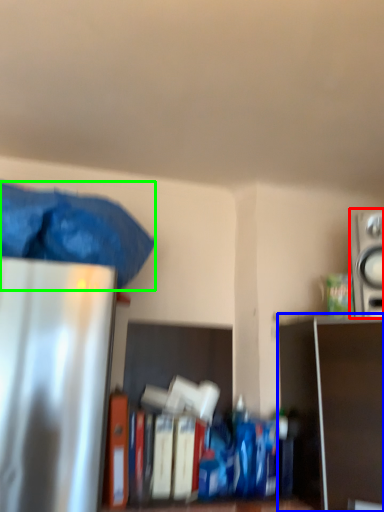
Question: Which object is the closest to the appliance (highlighted by a red box)? Choose among these: shelf (highlighted by a blue box) or waste (highlighted by a green box).

Choices:
 (A) shelf
 (B) waste

Answer: (A)